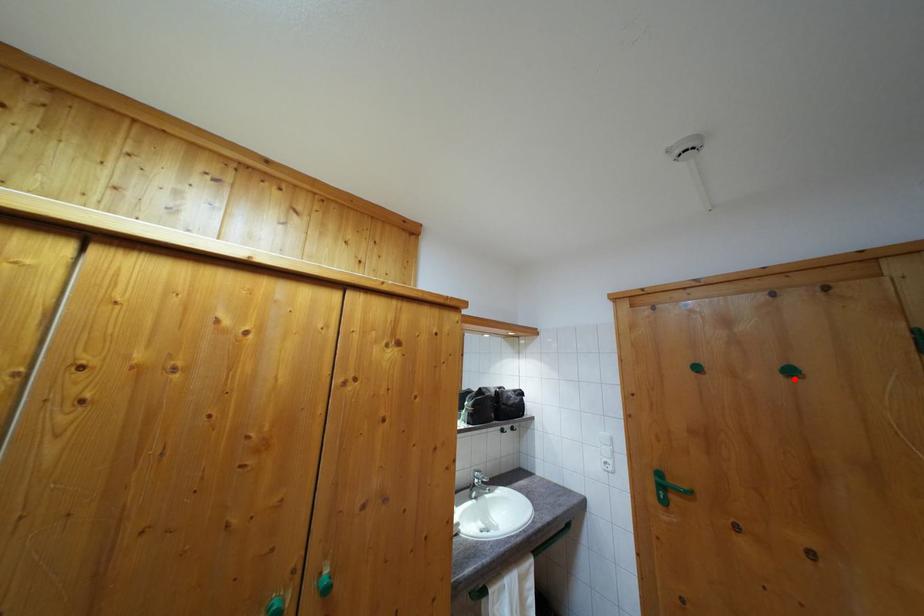
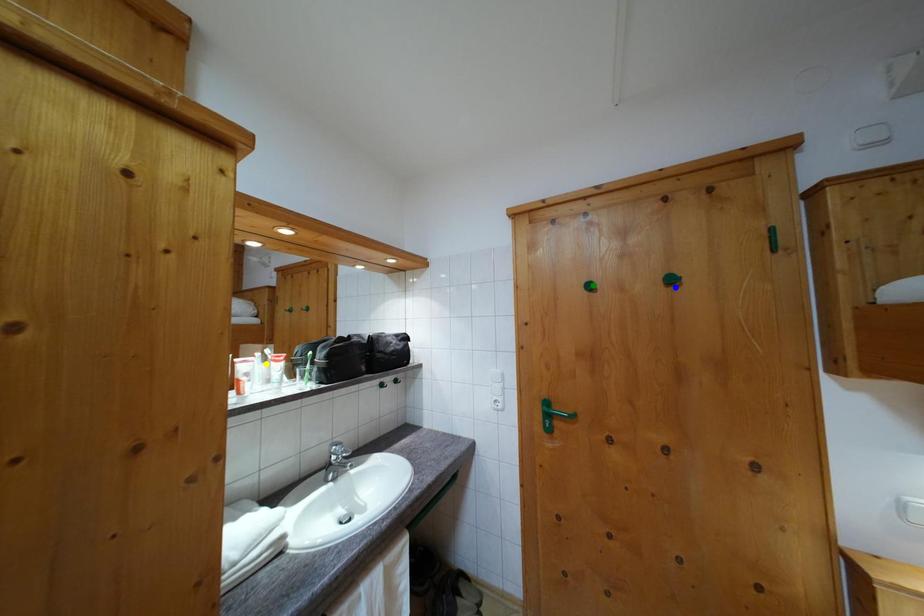
Question: I am providing you with two images of the same scene from different viewpoints. A red point is marked on the first image. You are given multiple points on the second image. Which spot in image 2 lines up with the point in image 1?

Choices:
 (A) yellow point
 (B) green point
 (C) blue point

Answer: (C)